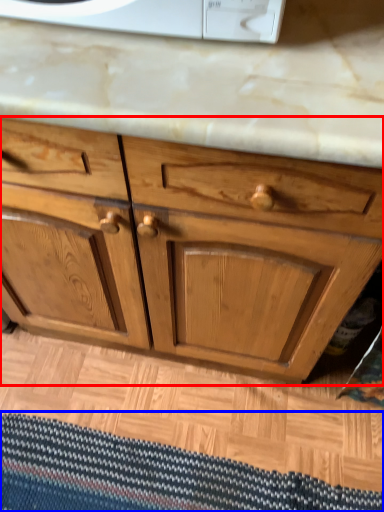
Question: Which object is further to the camera taking this photo, chest of drawers (highlighted by a red box) or doormat (highlighted by a blue box)?

Choices:
 (A) chest of drawers
 (B) doormat

Answer: (B)